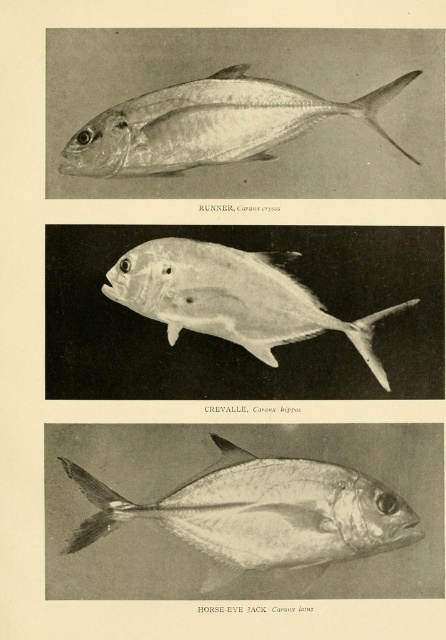
Question: Is silver metallic fish at upper center in front of silver metallic fish at center?

Choices:
 (A) yes
 (B) no

Answer: (A)

Question: Among these points, which one is farthest from the camera?

Choices:
 (A) (144, 102)
 (B) (338, 525)
 (C) (285, 323)

Answer: (C)

Question: Can you confirm if shiny silver fish at center is positioned below silver metallic fish at center?

Choices:
 (A) yes
 (B) no

Answer: (A)

Question: Can you confirm if silver metallic fish at upper center is positioned above silver metallic fish at center?

Choices:
 (A) yes
 (B) no

Answer: (A)

Question: Which of these objects is positioned closest to the silver metallic fish at upper center?

Choices:
 (A) silver metallic fish at center
 (B) shiny silver fish at center

Answer: (A)

Question: Which point is farther to the camera?

Choices:
 (A) silver metallic fish at upper center
 (B) shiny silver fish at center
 (C) silver metallic fish at center

Answer: (C)